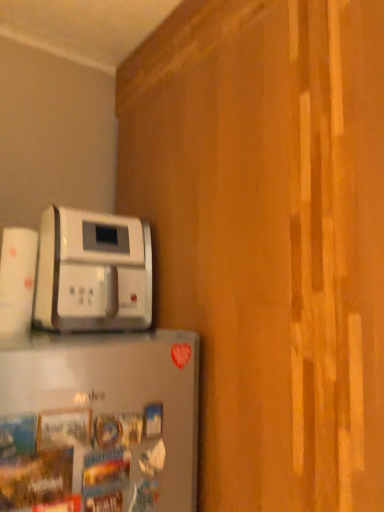
Question: From the image's perspective, is white plastic coffee maker at upper left, which ranks as the first home appliance in back-to-front order, located above satin silver refrigerator at lower left, which appears as the 1th home appliance when ordered from the bottom?

Choices:
 (A) no
 (B) yes

Answer: (B)

Question: Is white plastic coffee maker at upper left, which ranks as the first home appliance in back-to-front order, placed right next to satin silver refrigerator at lower left, arranged as the 2th home appliance when viewed from the back?

Choices:
 (A) no
 (B) yes

Answer: (A)

Question: Is white plastic coffee maker at upper left, which is the 1th home appliance from top to bottom, oriented towards satin silver refrigerator at lower left, which appears as the 1th home appliance when viewed from the front?

Choices:
 (A) yes
 (B) no

Answer: (B)

Question: Does white plastic coffee maker at upper left, which ranks as the first home appliance in back-to-front order, have a lesser width compared to satin silver refrigerator at lower left, which appears as the 1th home appliance when viewed from the front?

Choices:
 (A) yes
 (B) no

Answer: (B)

Question: Can you confirm if white plastic coffee maker at upper left, which is the 1th home appliance from top to bottom, is taller than satin silver refrigerator at lower left, the second home appliance from the top?

Choices:
 (A) no
 (B) yes

Answer: (A)

Question: From a real-world perspective, is white plastic coffee maker at upper left, marked as the second home appliance in a bottom-to-top arrangement, located beneath satin silver refrigerator at lower left, the second home appliance from the top?

Choices:
 (A) yes
 (B) no

Answer: (B)

Question: Does satin silver refrigerator at lower left, which appears as the 1th home appliance when ordered from the bottom, touch white plastic coffee maker at upper left, marked as the second home appliance in a bottom-to-top arrangement?

Choices:
 (A) no
 (B) yes

Answer: (A)

Question: Is white plastic coffee maker at upper left, the 2th home appliance positioned from the front, inside satin silver refrigerator at lower left, which appears as the 1th home appliance when viewed from the front?

Choices:
 (A) yes
 (B) no

Answer: (B)

Question: Is satin silver refrigerator at lower left, the second home appliance from the top, not near white plastic coffee maker at upper left, which is the 1th home appliance from top to bottom?

Choices:
 (A) no
 (B) yes

Answer: (A)

Question: From the image's perspective, is satin silver refrigerator at lower left, which appears as the 1th home appliance when ordered from the bottom, on top of white plastic coffee maker at upper left, which ranks as the first home appliance in back-to-front order?

Choices:
 (A) yes
 (B) no

Answer: (B)

Question: Considering the relative sizes of satin silver refrigerator at lower left, arranged as the 2th home appliance when viewed from the back, and white plastic coffee maker at upper left, marked as the second home appliance in a bottom-to-top arrangement, in the image provided, is satin silver refrigerator at lower left, arranged as the 2th home appliance when viewed from the back, wider than white plastic coffee maker at upper left, marked as the second home appliance in a bottom-to-top arrangement,?

Choices:
 (A) no
 (B) yes

Answer: (A)

Question: Is satin silver refrigerator at lower left, which appears as the 1th home appliance when ordered from the bottom, to the right of white plastic coffee maker at upper left, the 2th home appliance positioned from the front, from the viewer's perspective?

Choices:
 (A) no
 (B) yes

Answer: (B)

Question: Is white plastic coffee maker at upper left, marked as the second home appliance in a bottom-to-top arrangement, wider or thinner than satin silver refrigerator at lower left, the second home appliance from the top?

Choices:
 (A) thin
 (B) wide

Answer: (B)